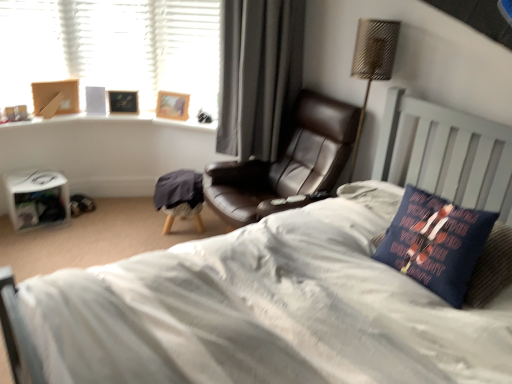
Question: Can we say wooden picture frame at upper left, the 1th picture frame when ordered from left to right, lies outside leather at center?

Choices:
 (A) yes
 (B) no

Answer: (A)

Question: Does wooden picture frame at upper left, acting as the second picture frame starting from the right, have a larger size compared to leather at center?

Choices:
 (A) no
 (B) yes

Answer: (A)

Question: Can you confirm if wooden picture frame at upper left, acting as the second picture frame starting from the right, is positioned to the right of leather at center?

Choices:
 (A) no
 (B) yes

Answer: (A)

Question: Is wooden picture frame at upper left, acting as the second picture frame starting from the right, closer to the viewer compared to leather at center?

Choices:
 (A) no
 (B) yes

Answer: (A)

Question: From the image's perspective, would you say wooden picture frame at upper left, the 1th picture frame when ordered from left to right, is shown under leather at center?

Choices:
 (A) no
 (B) yes

Answer: (A)

Question: Would you say wooden picture frame at upper left, the 1th picture frame when ordered from left to right, contains leather at center?

Choices:
 (A) no
 (B) yes

Answer: (A)

Question: From a real-world perspective, is black leather chair at center below dark blue fabric pillow at right?

Choices:
 (A) yes
 (B) no

Answer: (B)

Question: Would you say black leather chair at center is outside dark blue fabric pillow at right?

Choices:
 (A) no
 (B) yes

Answer: (B)

Question: Is black leather chair at center facing away from dark blue fabric pillow at right?

Choices:
 (A) no
 (B) yes

Answer: (A)

Question: Is black leather chair at center thinner than dark blue fabric pillow at right?

Choices:
 (A) yes
 (B) no

Answer: (B)

Question: Considering the relative sizes of black leather chair at center and dark blue fabric pillow at right in the image provided, is black leather chair at center smaller than dark blue fabric pillow at right?

Choices:
 (A) no
 (B) yes

Answer: (A)

Question: Can you confirm if black leather chair at center is taller than dark blue fabric pillow at right?

Choices:
 (A) yes
 (B) no

Answer: (A)

Question: Is metallic woven table lamp at upper right not inside wooden picture frame at upper left, the 1th picture frame when ordered from left to right?

Choices:
 (A) yes
 (B) no

Answer: (A)